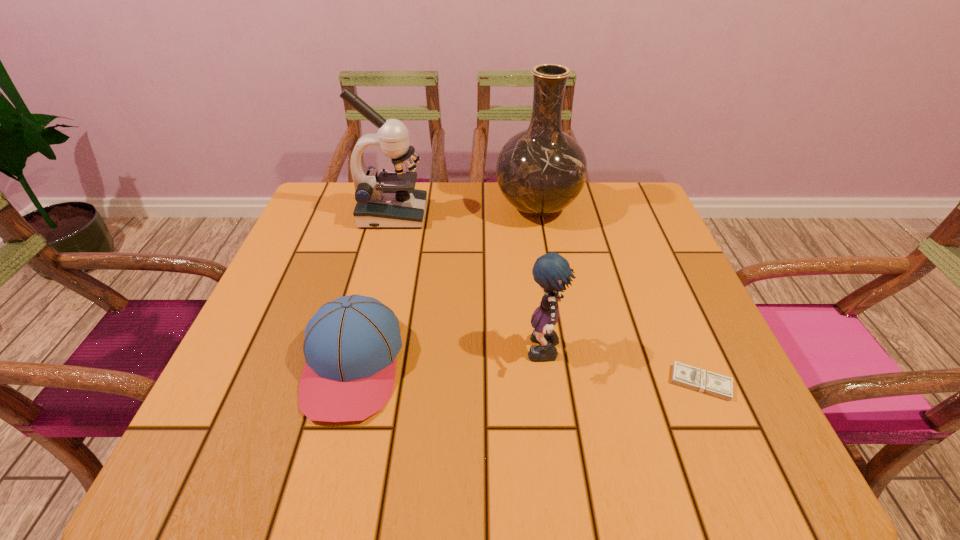
Identify the location of vase. (541, 170).

At what (x,y) coordinates should I click in order to perform the action: click on microscope. Please return your answer as a coordinate pair (x, y). The width and height of the screenshot is (960, 540). Looking at the image, I should click on (389, 200).

Where is `rag doll`? This screenshot has width=960, height=540. rag doll is located at coordinates (551, 271).

Where is `the second shortest object`? The height and width of the screenshot is (540, 960). the second shortest object is located at coordinates (350, 346).

I want to click on the rightmost object, so click(684, 375).

The width and height of the screenshot is (960, 540). What are the coordinates of `the shortest object` in the screenshot? It's located at (684, 375).

You are a GUI agent. You are given a task and a screenshot of the screen. Output one action in this format:
    pyautogui.click(x=<x>, y=<y>)
    Task: Click on the vacant space located 0.260m on the front of the vase
    This screenshot has width=960, height=540.
    Given the screenshot: What is the action you would take?
    pyautogui.click(x=554, y=309)

Find the location of `vacant point located 0.190m at the eyepiece of the microscope`. vacant point located 0.190m at the eyepiece of the microscope is located at coordinates (497, 215).

The height and width of the screenshot is (540, 960). In order to click on vacant area located 0.200m on the front-facing side of the rag doll in this screenshot , I will do `click(420, 354)`.

You are a GUI agent. You are given a task and a screenshot of the screen. Output one action in this format:
    pyautogui.click(x=<x>, y=<y>)
    Task: Click on the free space located on the front-facing side of the rag doll
    
    Given the screenshot: What is the action you would take?
    pyautogui.click(x=493, y=354)